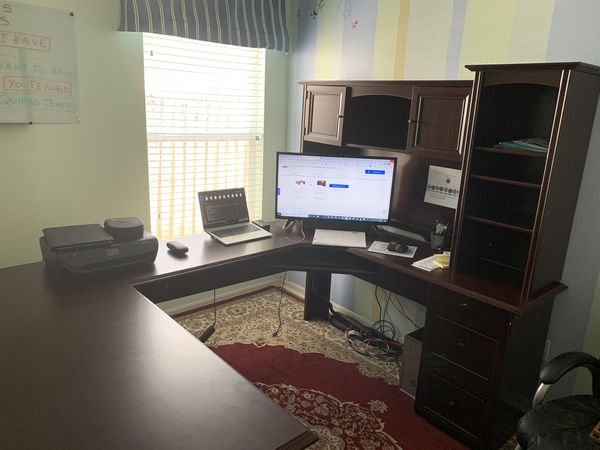
Where is `blinds on a window`? blinds on a window is located at coordinates (251, 133).